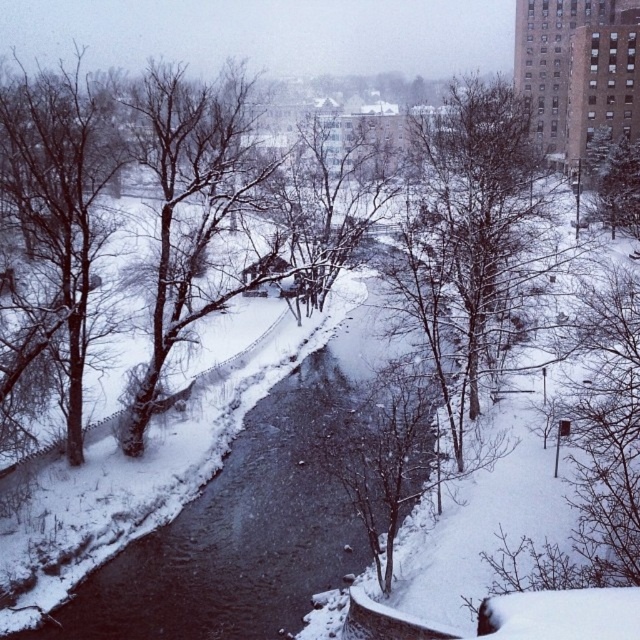
Question: Estimate the real-world distances between objects in this image. Which object is farther from the black ice river at center?

Choices:
 (A) snow-covered tree at center
 (B) bare branches at left

Answer: (B)

Question: Does bare branches at left appear over bare branches at center?

Choices:
 (A) no
 (B) yes

Answer: (A)

Question: Which point is farther to the camera?

Choices:
 (A) snow-covered tree at center
 (B) bare branches at center
 (C) black ice river at center

Answer: (B)

Question: From the image, what is the correct spatial relationship of bare branches at left in relation to snow-covered tree at center?

Choices:
 (A) above
 (B) below

Answer: (B)

Question: Which point is closer to the camera?

Choices:
 (A) (516, 109)
 (B) (241, 621)

Answer: (B)

Question: Is bare branches at left below snow-covered tree at center?

Choices:
 (A) no
 (B) yes

Answer: (B)